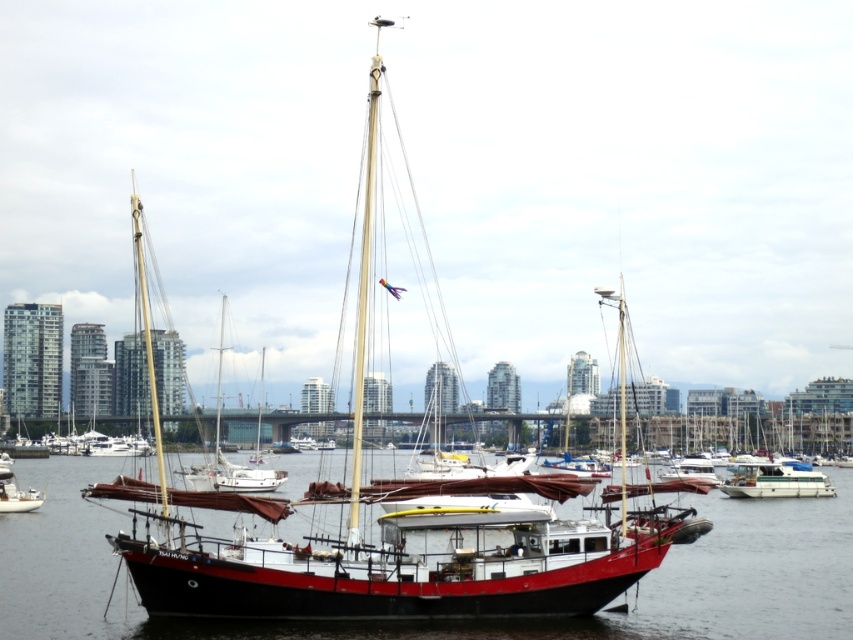
Question: Does red matte sailboat at center have a greater width compared to black matte water at center?

Choices:
 (A) yes
 (B) no

Answer: (B)

Question: Which object is the farthest from the black matte water at center?

Choices:
 (A) matte black sailboat at left
 (B) white glossy catamaran at center
 (C) red matte sailboat at center

Answer: (A)

Question: Is red matte sailboat at center in front of white glossy catamaran at center?

Choices:
 (A) yes
 (B) no

Answer: (A)

Question: Estimate the real-world distances between objects in this image. Which object is farther from the white glossy catamaran at center?

Choices:
 (A) red matte sailboat at center
 (B) black matte water at center

Answer: (A)

Question: Estimate the real-world distances between objects in this image. Which object is closer to the matte black sailboat at left?

Choices:
 (A) white glossy catamaran at center
 (B) black matte water at center

Answer: (B)

Question: Where is black matte water at center located in relation to white glossy catamaran at center in the image?

Choices:
 (A) left
 (B) right

Answer: (A)